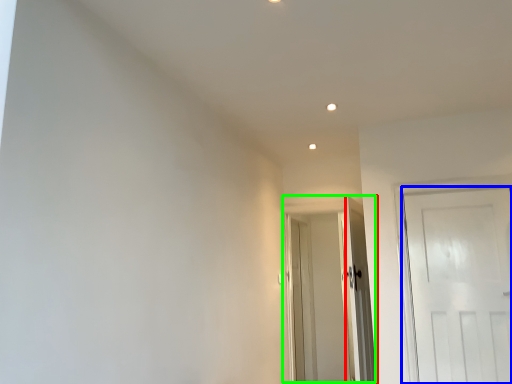
Question: Based on their relative distances, which object is nearer to door (highlighted by a red box)? Choose from door (highlighted by a blue box) and door (highlighted by a green box).

Choices:
 (A) door
 (B) door

Answer: (A)